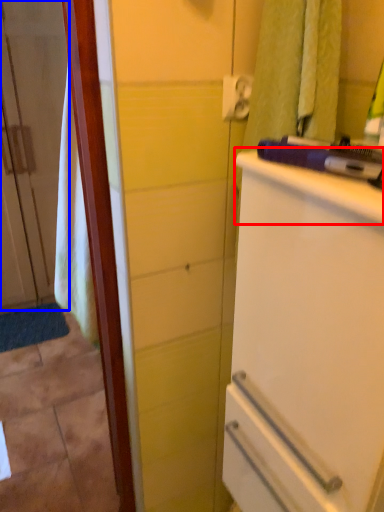
Question: Which object appears farthest to the camera in this image, counter top (highlighted by a red box) or door (highlighted by a blue box)?

Choices:
 (A) counter top
 (B) door

Answer: (B)